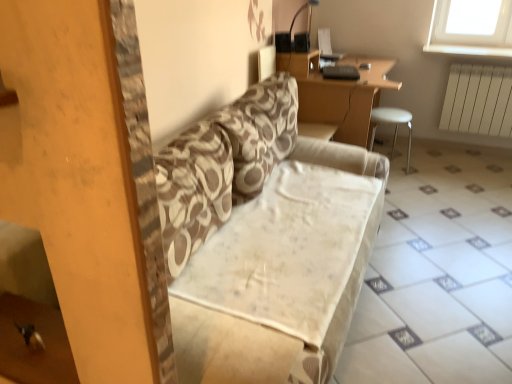
The height and width of the screenshot is (384, 512). What do you see at coordinates (437, 275) in the screenshot? I see `beige fabric ottoman at center` at bounding box center [437, 275].

What is the approximate height of white plastic radiator at right?

25.94 inches.

Measure the distance between point (509, 126) and camera.

Point (509, 126) is 3.52 meters from camera.

Where is `white plastic stool at right`? The height and width of the screenshot is (384, 512). white plastic stool at right is located at coordinates (391, 122).

What do you see at coordinates (391, 122) in the screenshot?
I see `white plastic stool at right` at bounding box center [391, 122].

At what (x,y) coordinates should I click in order to perform the action: click on beige fabric ottoman at center. Please return your answer as a coordinate pair (x, y). The image size is (512, 384). Looking at the image, I should click on (437, 275).

From the image's perspective, is beige fabric ottoman at center on wooden desk at upper center?

No, from the image's perspective, beige fabric ottoman at center is not over wooden desk at upper center.

At what (x,y) coordinates should I click in order to perform the action: click on tile below the wooden desk at upper center (from the image's perspective). Please return your answer as a coordinate pair (x, y). This screenshot has height=384, width=512. Looking at the image, I should click on (437, 275).

Which point is more distant from viewer, (451, 324) or (321, 123)?

Point (321, 123)

Considering their positions, is beige fabric ottoman at center located in front of or behind wooden desk at upper center?

beige fabric ottoman at center is in front of wooden desk at upper center.

Consider the image. From a real-world perspective, who is located lower, beige fabric ottoman at center or white plastic radiator at right?

beige fabric ottoman at center.

Based on the photo, is beige fabric ottoman at center spatially inside white plastic radiator at right, or outside of it?

beige fabric ottoman at center cannot be found inside white plastic radiator at right.

From the picture: Could you tell me if beige fabric ottoman at center is facing white plastic radiator at right?

No.

Would you say beige fabric ottoman at center is a long distance from white plastic radiator at right?

beige fabric ottoman at center is far away from white plastic radiator at right.

Is patterned fabric couch at center wider or thinner than beige fabric ottoman at center?

In the image, patterned fabric couch at center appears to be more narrow than beige fabric ottoman at center.

From the image's perspective, which is below, patterned fabric couch at center or beige fabric ottoman at center?

beige fabric ottoman at center.

Does point (301, 261) come behind point (481, 205)?

No, (301, 261) is in front of (481, 205).

Considering the relative sizes of beige fabric ottoman at center and white plastic stool at right in the image provided, is beige fabric ottoman at center bigger than white plastic stool at right?

Yes.

Considering the relative sizes of beige fabric ottoman at center and white plastic stool at right in the image provided, is beige fabric ottoman at center shorter than white plastic stool at right?

Correct, beige fabric ottoman at center is not as tall as white plastic stool at right.

Does point (410, 334) come closer to viewer compared to point (410, 121)?

Yes.

Can you tell me how much beige fabric ottoman at center and white plastic stool at right differ in facing direction?

87.2 degrees.

Are wooden desk at upper center and beige fabric ottoman at center beside each other?

No, wooden desk at upper center is not beside beige fabric ottoman at center.

Can you tell me how much wooden desk at upper center and beige fabric ottoman at center differ in facing direction?

They differ by 87.5 degrees in their facing directions.

How far apart are wooden desk at upper center and beige fabric ottoman at center?

They are 38.41 inches apart.

Which is behind, point (348, 106) or point (474, 159)?

The point (474, 159) is more distant.

Looking at this image, can you confirm if patterned fabric couch at center is thinner than white plastic radiator at right?

No, patterned fabric couch at center is not thinner than white plastic radiator at right.

From a real-world perspective, who is located lower, patterned fabric couch at center or white plastic radiator at right?

From a 3D spatial view, patterned fabric couch at center is below.

Consider the image. Between patterned fabric couch at center and white plastic radiator at right, which one appears on the right side from the viewer's perspective?

white plastic radiator at right is more to the right.

Are patterned fabric couch at center and white plastic radiator at right making contact?

No, patterned fabric couch at center is not beside white plastic radiator at right.

Which of these two, white plastic stool at right or white plastic radiator at right, is wider?

With larger width is white plastic stool at right.

Find the location of a particular element. This screenshot has height=384, width=512. furniture in front of the white plastic radiator at right is located at coordinates (391, 122).

From the image's perspective, is white plastic stool at right below white plastic radiator at right?

Yes.

From a real-world perspective, which object stands above the other?

white plastic radiator at right, from a real-world perspective.

Where is `table located behind the beige fabric ottoman at center`? The width and height of the screenshot is (512, 384). table located behind the beige fabric ottoman at center is located at coordinates (338, 94).

In the image, there is a white plastic radiator at right. Where is `tile below it (from the image's perspective)`? Image resolution: width=512 pixels, height=384 pixels. tile below it (from the image's perspective) is located at coordinates (437, 275).

Which object lies further to the anchor point beige fabric ottoman at center, wooden desk at upper center or white plastic radiator at right?

The object further to beige fabric ottoman at center is white plastic radiator at right.

Considering their positions, is beige fabric ottoman at center positioned closer to patterned fabric couch at center than white plastic stool at right?

Among the two, beige fabric ottoman at center is located nearer to patterned fabric couch at center.

Which object lies further to the anchor point wooden desk at upper center, white plastic radiator at right or patterned fabric couch at center?

white plastic radiator at right is positioned further to the anchor wooden desk at upper center.

Considering their positions, is beige fabric ottoman at center positioned further to white plastic radiator at right than patterned fabric couch at center?

patterned fabric couch at center is positioned further to the anchor white plastic radiator at right.

Estimate the real-world distances between objects in this image. Which object is closer to white plastic radiator at right, beige fabric ottoman at center or white plastic stool at right?

white plastic stool at right lies closer to white plastic radiator at right than the other object.

Looking at the image, which one is located further to white plastic radiator at right, patterned fabric couch at center or white plastic stool at right?

patterned fabric couch at center is positioned further to the anchor white plastic radiator at right.

Looking at the image, which one is located closer to white plastic stool at right, wooden desk at upper center or beige fabric ottoman at center?

wooden desk at upper center is closer to white plastic stool at right.

Considering their positions, is wooden desk at upper center positioned closer to patterned fabric couch at center than beige fabric ottoman at center?

Among the two, beige fabric ottoman at center is located nearer to patterned fabric couch at center.

Identify the location of tile positioned between patterned fabric couch at center and white plastic radiator at right from near to far. The image size is (512, 384). (437, 275).

At what (x,y) coordinates should I click in order to perform the action: click on tile positioned between patterned fabric couch at center and white plastic stool at right from near to far. Please return your answer as a coordinate pair (x, y). This screenshot has height=384, width=512. Looking at the image, I should click on (437, 275).

At what (x,y) coordinates should I click in order to perform the action: click on table between patterned fabric couch at center and white plastic stool at right in the front-back direction. Please return your answer as a coordinate pair (x, y). The image size is (512, 384). Looking at the image, I should click on (338, 94).

You are a GUI agent. You are given a task and a screenshot of the screen. Output one action in this format:
    pyautogui.click(x=<x>, y=<y>)
    Task: Click on the table positioned between beige fabric ottoman at center and white plastic stool at right from near to far
    The width and height of the screenshot is (512, 384).
    Given the screenshot: What is the action you would take?
    pyautogui.click(x=338, y=94)